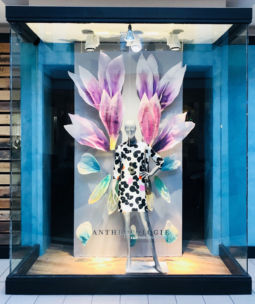
Image resolution: width=255 pixels, height=304 pixels. What are the coordinates of `white tile floor` in the screenshot? It's located at (103, 299).